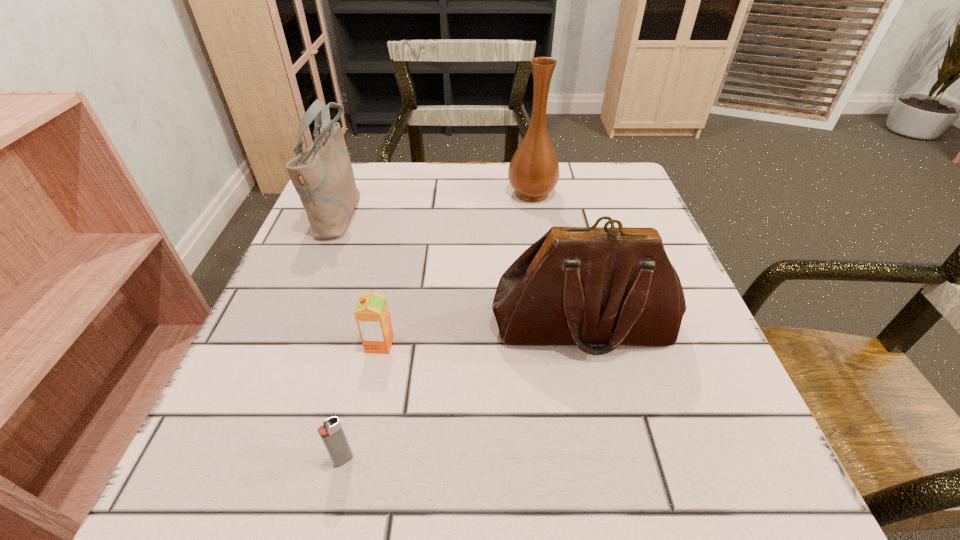
This screenshot has height=540, width=960. Find the location of `free spot between the shortest object and the vase`. free spot between the shortest object and the vase is located at coordinates (438, 327).

I want to click on free point between the vase and the orange juice, so click(456, 269).

Identify which object is the fourth nearest to the vase. Please provide its 2D coordinates. Your answer should be formatted as a tuple, i.e. [(x, y)], where the tuple contains the x and y coordinates of a point satisfying the conditions above.

[(331, 432)]

At what (x,y) coordinates should I click in order to perform the action: click on object that is the closest to the shortest object. Please return your answer as a coordinate pair (x, y). This screenshot has height=540, width=960. Looking at the image, I should click on (372, 315).

The image size is (960, 540). I want to click on vacant space that satisfies the following two spatial constraints: 1. on the front-facing side of the left shoulder bag; 2. on the right side of the igniter, so click(238, 460).

Identify the location of vacant space that satisfies the following two spatial constraints: 1. on the front side of the nearer shoulder bag; 2. on the left side of the vase. (553, 326).

You are a GUI agent. You are given a task and a screenshot of the screen. Output one action in this format:
    pyautogui.click(x=<x>, y=<y>)
    Task: Click on the blank space that satisfies the following two spatial constraints: 1. on the front-facing side of the left shoulder bag; 2. on the right side of the orange juice
    This screenshot has width=960, height=540.
    Given the screenshot: What is the action you would take?
    pyautogui.click(x=285, y=344)

The height and width of the screenshot is (540, 960). I want to click on free space that satisfies the following two spatial constraints: 1. on the back side of the shortest object; 2. on the right side of the nearer shoulder bag, so click(x=374, y=326).

I want to click on vacant space that satisfies the following two spatial constraints: 1. on the front-facing side of the left shoulder bag; 2. on the right side of the orange juice, so click(x=285, y=344).